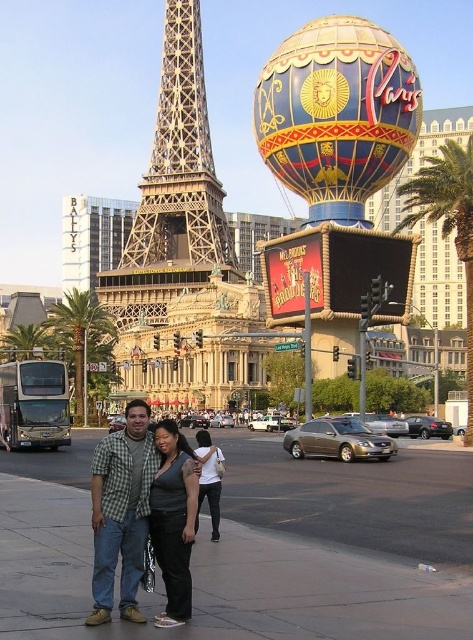
You are a photographer standing on the Las Vegas Strip. You want to capture a photo of the green leafy palm tree at right and the matte black dress at center. Given that your camera has a maximum focus range of 100 feet, will you be able to get both subjects in focus at the same time?

The green leafy palm tree at right and the matte black dress at center are 125.47 feet apart. Since your camera can only focus up to 100 feet, you won let both subjects be in focus simultaneously.

You are a photographer taking a picture of the blue glossy balloon at upper center and the dark gray fabric shirt at center. Which object is positioned to the right of the other?

The blue glossy balloon at upper center is to the right of the dark gray fabric shirt at center.

You are taking a photo of the blue glossy balloon at upper center and the dark gray fabric shirt at center. Which object is positioned higher in the image?

The blue glossy balloon at upper center is located above the dark gray fabric shirt at center, so it is positioned higher in the image.